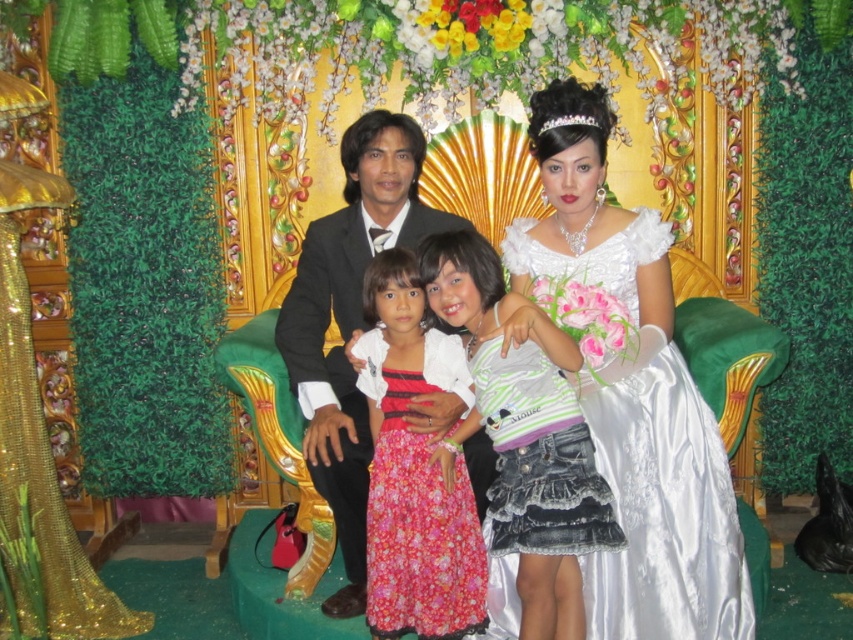
Question: Does shiny black suit at center have a greater width compared to floral cotton dress at center?

Choices:
 (A) yes
 (B) no

Answer: (A)

Question: Which object appears closest to the camera in this image?

Choices:
 (A) white satin dress at center
 (B) striped jersey at center

Answer: (B)

Question: Which point is farther to the camera?

Choices:
 (A) shiny black suit at center
 (B) floral cotton dress at center
 (C) striped jersey at center
 (D) white satin dress at center

Answer: (A)

Question: Does shiny black suit at center have a larger size compared to floral cotton dress at center?

Choices:
 (A) yes
 (B) no

Answer: (A)

Question: Which point is closer to the camera?

Choices:
 (A) (335, 316)
 (B) (366, 564)
 (C) (512, 508)
 (D) (573, 356)

Answer: (C)

Question: Can you confirm if white satin dress at center is wider than shiny black suit at center?

Choices:
 (A) no
 (B) yes

Answer: (B)